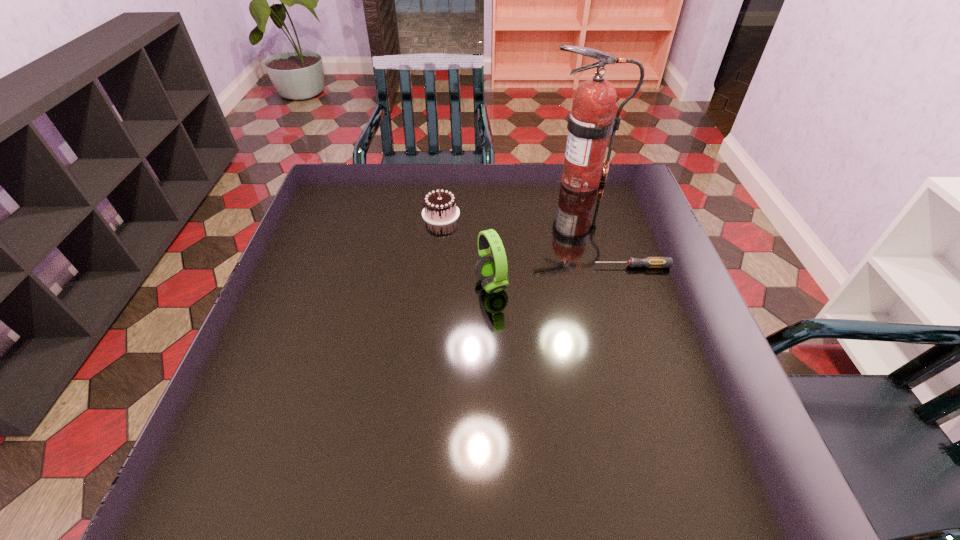
Identify the location of free space located 0.210m on the left of the headset. This screenshot has width=960, height=540. (388, 285).

Identify the location of vacant space located 0.390m on the right of the chocolate cake. The width and height of the screenshot is (960, 540). (596, 213).

At what (x,y) coordinates should I click in order to perform the action: click on vacant space situated insert the shortest object into a screw head. Please return your answer as a coordinate pair (x, y). The height and width of the screenshot is (540, 960). Looking at the image, I should click on (435, 266).

You are a GUI agent. You are given a task and a screenshot of the screen. Output one action in this format:
    pyautogui.click(x=<x>, y=<y>)
    Task: Click on the free space located 0.220m insert the shortest object into a screw head
    
    Given the screenshot: What is the action you would take?
    pyautogui.click(x=506, y=266)

This screenshot has width=960, height=540. I want to click on vacant area situated 0.190m insert the shortest object into a screw head, so click(x=518, y=266).

Find the location of `fire extinguisher that is at the far edge`. fire extinguisher that is at the far edge is located at coordinates (591, 121).

Where is `chocolate cake situated at the far edge`? The image size is (960, 540). chocolate cake situated at the far edge is located at coordinates (440, 208).

At what (x,y) coordinates should I click in order to perform the action: click on fire extinguisher present at the right edge. Please return your answer as a coordinate pair (x, y). The image size is (960, 540). Looking at the image, I should click on (591, 121).

You are a GUI agent. You are given a task and a screenshot of the screen. Output one action in this format:
    pyautogui.click(x=<x>, y=<y>)
    Task: Click on the screwdriver situated at the right edge
    The image size is (960, 540).
    Given the screenshot: What is the action you would take?
    pyautogui.click(x=651, y=262)

The image size is (960, 540). I want to click on object situated at the far right corner, so click(591, 121).